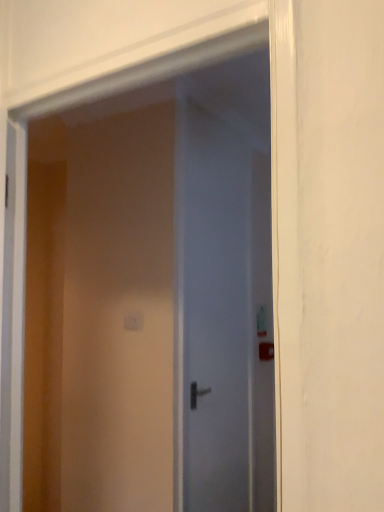
Question: Is white glossy door at center, the first door positioned from the front, bigger or smaller than satin white door at center, which is the 1th door from back to front?

Choices:
 (A) small
 (B) big

Answer: (B)

Question: Relative to satin white door at center, which is the 1th door from back to front, is white glossy door at center, the first door positioned from the front, in front or behind?

Choices:
 (A) front
 (B) behind

Answer: (A)

Question: Which object is positioned closest to the white plastic light switch at center?

Choices:
 (A) satin white door at center, which is the 1th door from back to front
 (B) white glossy door at center, the first door positioned from the front

Answer: (A)

Question: Which object is the closest to the white glossy door at center, the first door positioned from the front?

Choices:
 (A) white plastic light switch at center
 (B) satin white door at center, which is the 1th door from back to front

Answer: (B)